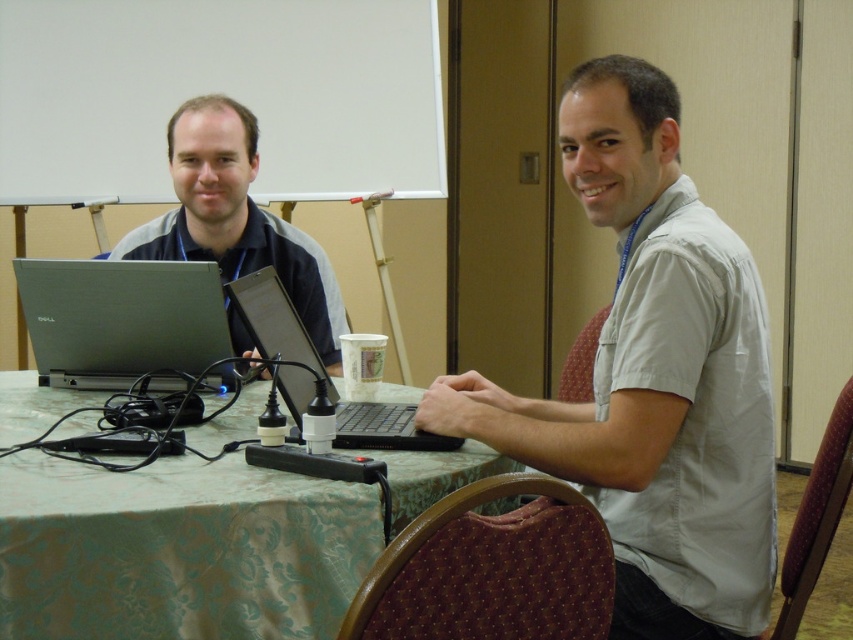
Is light gray shirt at center behind black plastic laptop at center?

That is False.

Find the location of a particular element. Image resolution: width=853 pixels, height=640 pixels. light gray shirt at center is located at coordinates (653, 378).

Measure the distance between point (680, 403) and camera.

They are 1.34 meters apart.

You are a GUI agent. You are given a task and a screenshot of the screen. Output one action in this format:
    pyautogui.click(x=<x>, y=<y>)
    Task: Click on the light gray shirt at center
    The height and width of the screenshot is (640, 853).
    Given the screenshot: What is the action you would take?
    pyautogui.click(x=653, y=378)

Is silver metallic laptop at center wider than matte black laptop at left?

No.

From the picture: Can you confirm if silver metallic laptop at center is positioned to the right of matte black laptop at left?

Incorrect, silver metallic laptop at center is not on the right side of matte black laptop at left.

You are a GUI agent. You are given a task and a screenshot of the screen. Output one action in this format:
    pyautogui.click(x=<x>, y=<y>)
    Task: Click on the silver metallic laptop at center
    The height and width of the screenshot is (640, 853).
    Given the screenshot: What is the action you would take?
    pyautogui.click(x=120, y=321)

Measure the distance between point (677,100) and camera.

Point (677,100) is 4.94 feet away from camera.

This screenshot has height=640, width=853. What do you see at coordinates (653, 378) in the screenshot? I see `light gray shirt at center` at bounding box center [653, 378].

Which is in front, point (711, 496) or point (236, 506)?

Positioned in front is point (236, 506).

This screenshot has height=640, width=853. What are the coordinates of `light gray shirt at center` in the screenshot? It's located at (653, 378).